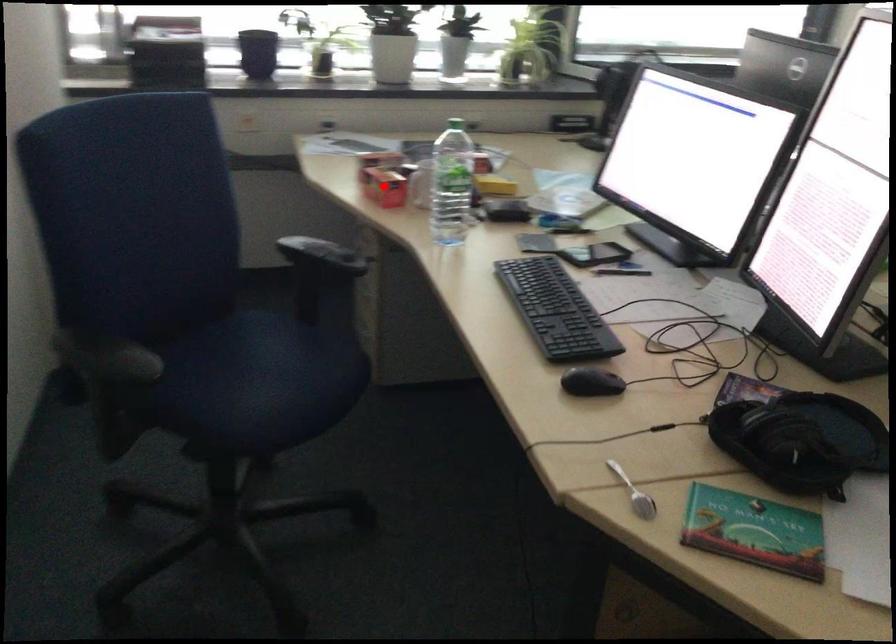
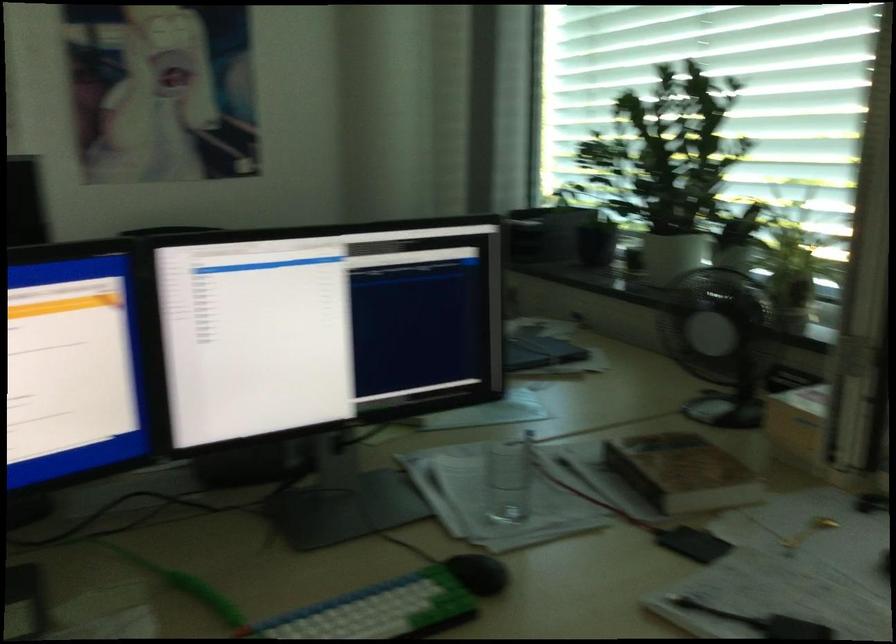
Question: I am providing you with two images of the same scene from different viewpoints. A red point is marked on the first image. Is the red point's position out of view in image 2?

Choices:
 (A) Yes
 (B) No

Answer: (A)